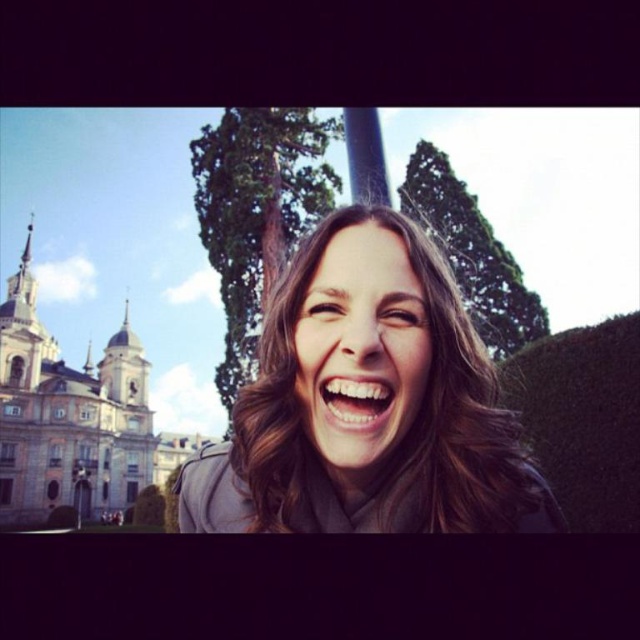
You are a photographer trying to capture the perfect shot of the person in front of the historic building. Considering the brown matte hair at center and the white glossy teeth at center, which object would you need to frame more broadly to ensure it fits within the camera viewfinder?

The brown matte hair at center needs to be framed more broadly because its width surpasses that of the white glossy teeth at center, making it wider and thus requiring more space in the frame.